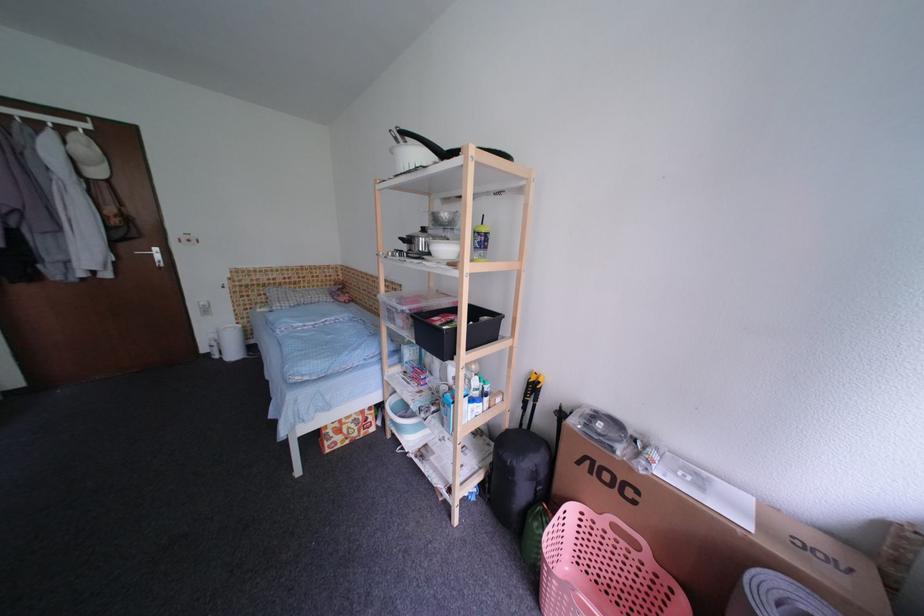
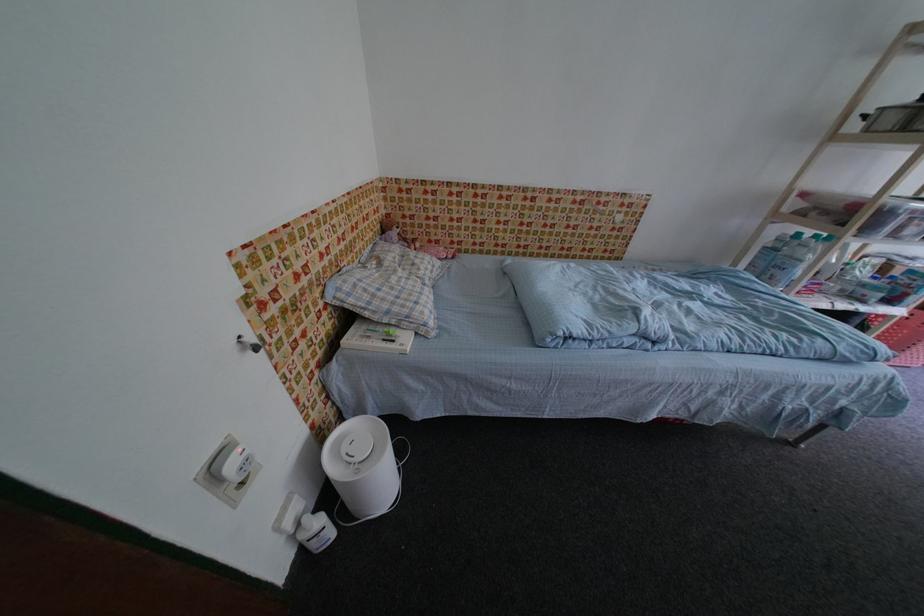
Find the pixel in the second image that matches the point at 314,286 in the first image.

(370, 246)